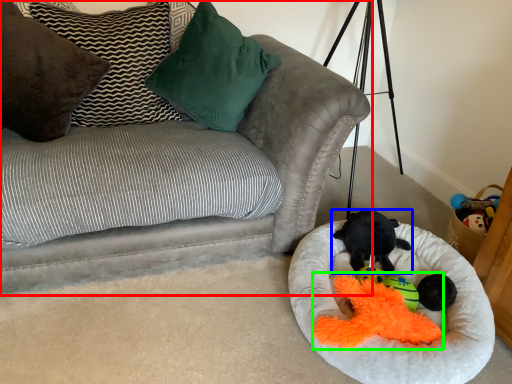
Question: Which object is the closest to the studio couch (highlighted by a red box)? Choose among these: toy (highlighted by a blue box) or miniature (highlighted by a green box).

Choices:
 (A) toy
 (B) miniature

Answer: (A)